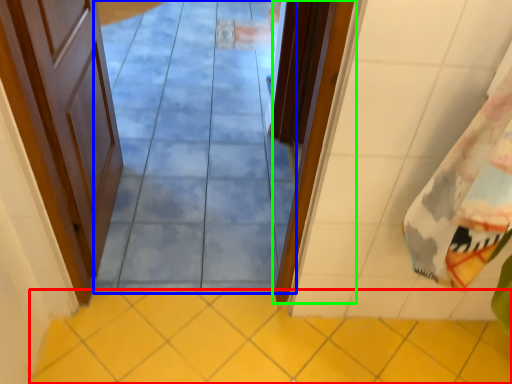
Question: Which is nearer to the ceramic tile (highlighted by a red box)? path (highlighted by a blue box) or door (highlighted by a green box).

Choices:
 (A) path
 (B) door

Answer: (B)